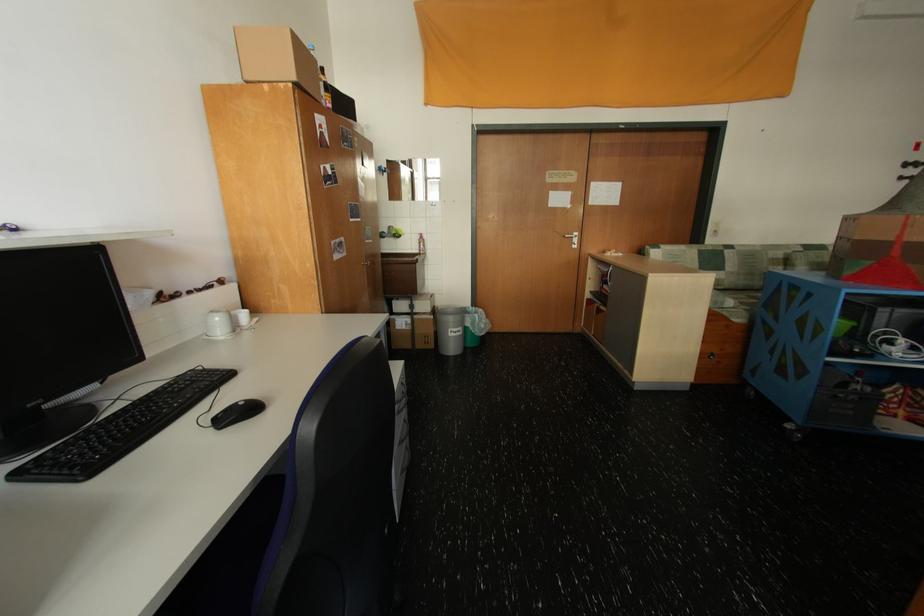
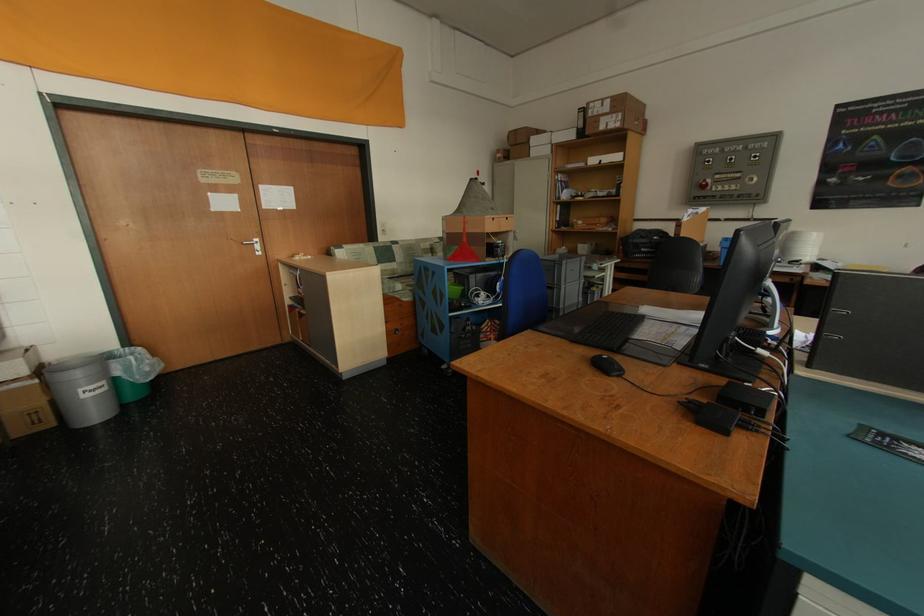
Where in the second image is the point corresponding to pixel 464 334 from the first image?

(101, 392)